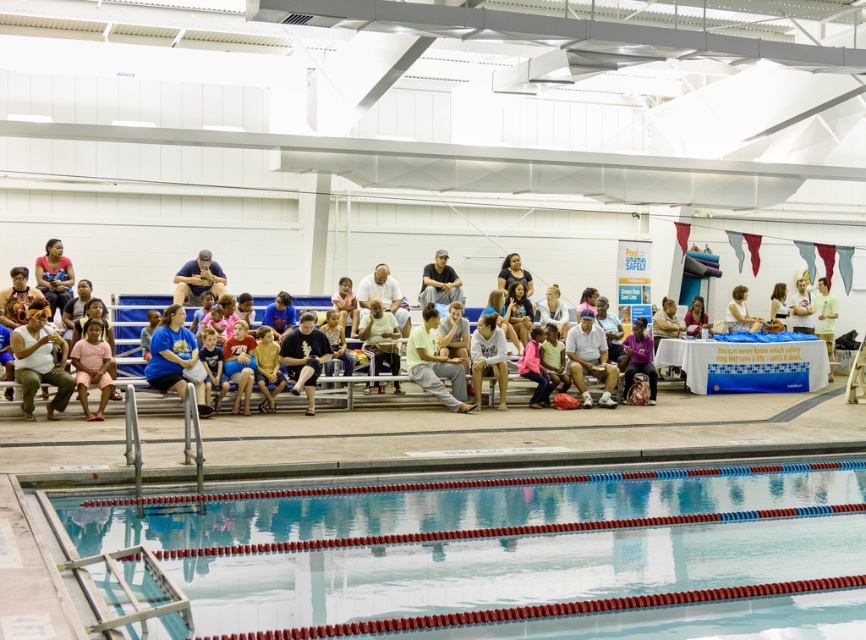
Question: Does white cotton tank top at left appear under dark gray pants at center?

Choices:
 (A) no
 (B) yes

Answer: (B)

Question: Which of the following is the farthest from the observer?

Choices:
 (A) white cotton tank top at left
 (B) matte black shirt at upper left
 (C) light brown hair at upper right
 (D) clear plastic pool at lower center

Answer: (C)

Question: Is blue jersey at center below matte black shirt at upper left?

Choices:
 (A) yes
 (B) no

Answer: (A)

Question: Among these objects, which one is nearest to the camera?

Choices:
 (A) clear plastic pool at lower center
 (B) matte black shirt at upper left
 (C) light brown hair at upper right

Answer: (A)

Question: Which object is the closest to the blue jersey at center?

Choices:
 (A) light yellow fabric shirt at center
 (B) dark gray pants at center
 (C) matte black shirt at upper left
 (D) light brown hair at upper right

Answer: (C)

Question: Can you confirm if light yellow fabric shirt at center is positioned to the right of dark gray pants at center?

Choices:
 (A) yes
 (B) no

Answer: (B)